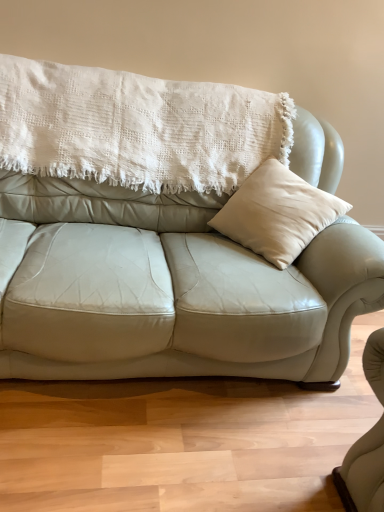
Question: Is point (258, 123) closer or farther from the camera than point (9, 352)?

Choices:
 (A) closer
 (B) farther

Answer: (B)

Question: Is white textured blanket at upper center situated inside light beige leather couch at center or outside?

Choices:
 (A) outside
 (B) inside

Answer: (B)

Question: From the image's perspective, is white textured blanket at upper center positioned above or below light beige leather couch at center?

Choices:
 (A) below
 (B) above

Answer: (B)

Question: From a real-world perspective, is light beige leather couch at center physically located above or below white textured blanket at upper center?

Choices:
 (A) above
 (B) below

Answer: (B)

Question: Does point (18, 89) appear closer or farther from the camera than point (117, 173)?

Choices:
 (A) farther
 (B) closer

Answer: (B)

Question: Would you say light beige leather couch at center is to the left or to the right of white textured blanket at upper center in the picture?

Choices:
 (A) right
 (B) left

Answer: (A)

Question: Considering the positions of light beige leather couch at center and white textured blanket at upper center in the image, is light beige leather couch at center bigger or smaller than white textured blanket at upper center?

Choices:
 (A) small
 (B) big

Answer: (B)